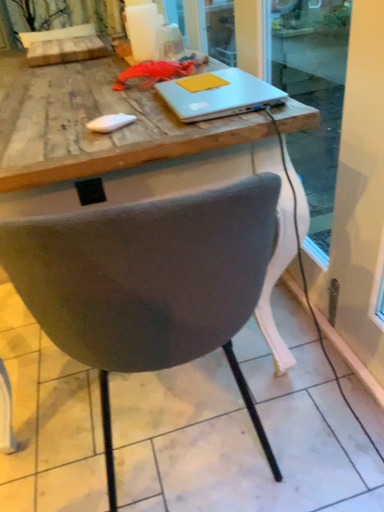
Where is `vacant area situated to the left side of gray fabric chair at center`? The image size is (384, 512). vacant area situated to the left side of gray fabric chair at center is located at coordinates (46, 423).